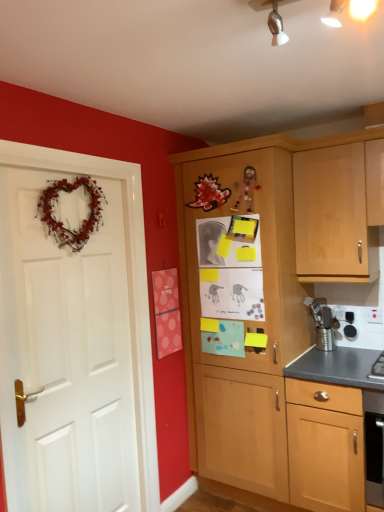
Question: Is pink polka dot postcard at center far from metallic silver utensil holder at right?

Choices:
 (A) yes
 (B) no

Answer: (B)

Question: From the image's perspective, is pink polka dot postcard at center over metallic silver utensil holder at right?

Choices:
 (A) no
 (B) yes

Answer: (B)

Question: Is pink polka dot postcard at center to the right of metallic silver utensil holder at right from the viewer's perspective?

Choices:
 (A) yes
 (B) no

Answer: (B)

Question: Is pink polka dot postcard at center bigger than metallic silver utensil holder at right?

Choices:
 (A) no
 (B) yes

Answer: (B)

Question: Is pink polka dot postcard at center outside metallic silver utensil holder at right?

Choices:
 (A) no
 (B) yes

Answer: (B)

Question: Can you confirm if pink polka dot postcard at center is positioned to the left of metallic silver utensil holder at right?

Choices:
 (A) no
 (B) yes

Answer: (B)

Question: Does pink polka dot postcard at center appear on the left side of white matte door at left?

Choices:
 (A) no
 (B) yes

Answer: (A)

Question: Is pink polka dot postcard at center shorter than white matte door at left?

Choices:
 (A) no
 (B) yes

Answer: (B)

Question: Is there a large distance between pink polka dot postcard at center and white matte door at left?

Choices:
 (A) yes
 (B) no

Answer: (B)

Question: Could white matte door at left be considered to be inside pink polka dot postcard at center?

Choices:
 (A) yes
 (B) no

Answer: (B)

Question: Considering the relative sizes of pink polka dot postcard at center and white matte door at left in the image provided, is pink polka dot postcard at center thinner than white matte door at left?

Choices:
 (A) no
 (B) yes

Answer: (B)

Question: Does pink polka dot postcard at center have a larger size compared to white matte door at left?

Choices:
 (A) yes
 (B) no

Answer: (B)

Question: Considering the relative sizes of metallic silver utensil holder at right and white matte door at left in the image provided, is metallic silver utensil holder at right taller than white matte door at left?

Choices:
 (A) yes
 (B) no

Answer: (B)